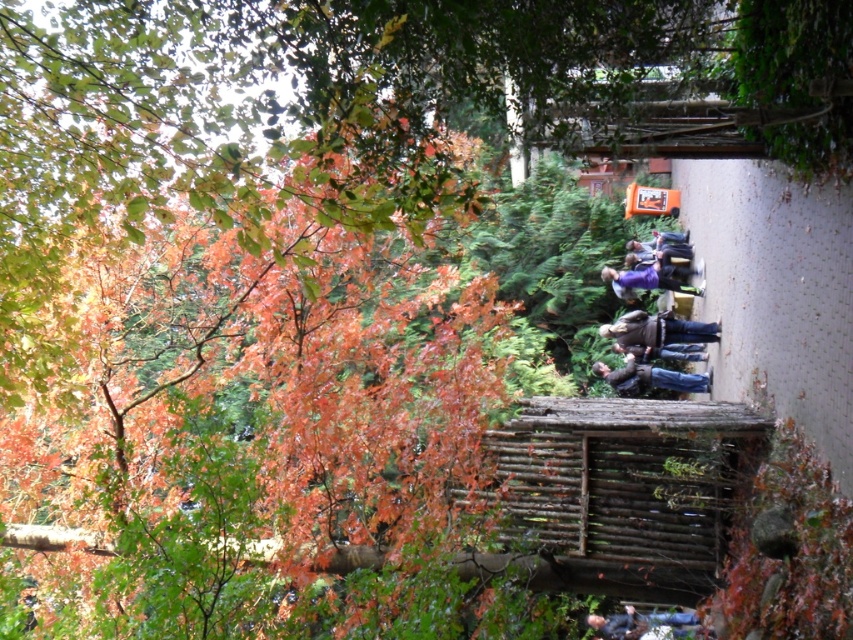
You are standing in the autumn scene and notice two items in the image. One is dark blue jeans at center and the other is matte black jacket at lower center. Which item is positioned higher up in the image?

The dark blue jeans at center is located above the matte black jacket at lower center in the image.